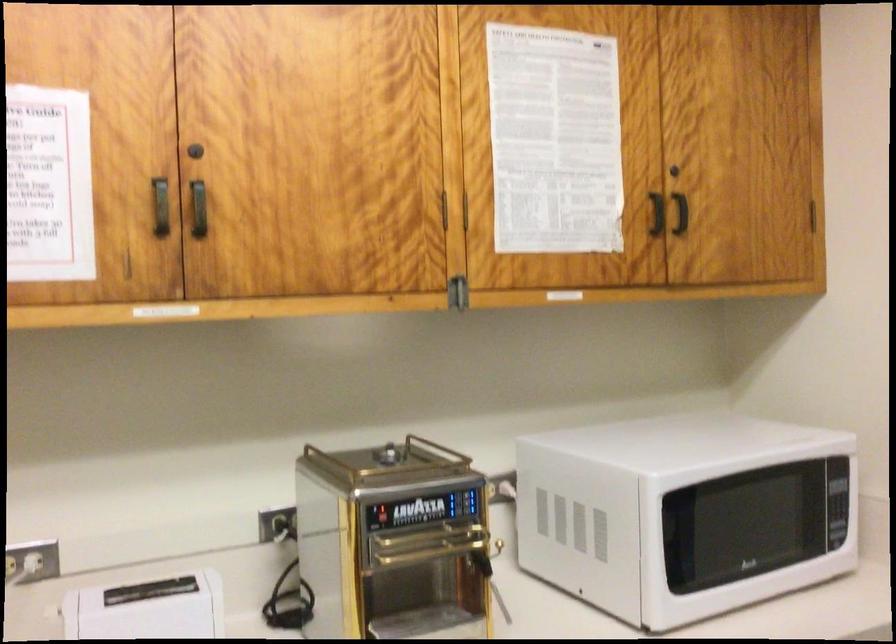
The image size is (896, 644). What do you see at coordinates (392, 542) in the screenshot? I see `a portafilter handle` at bounding box center [392, 542].